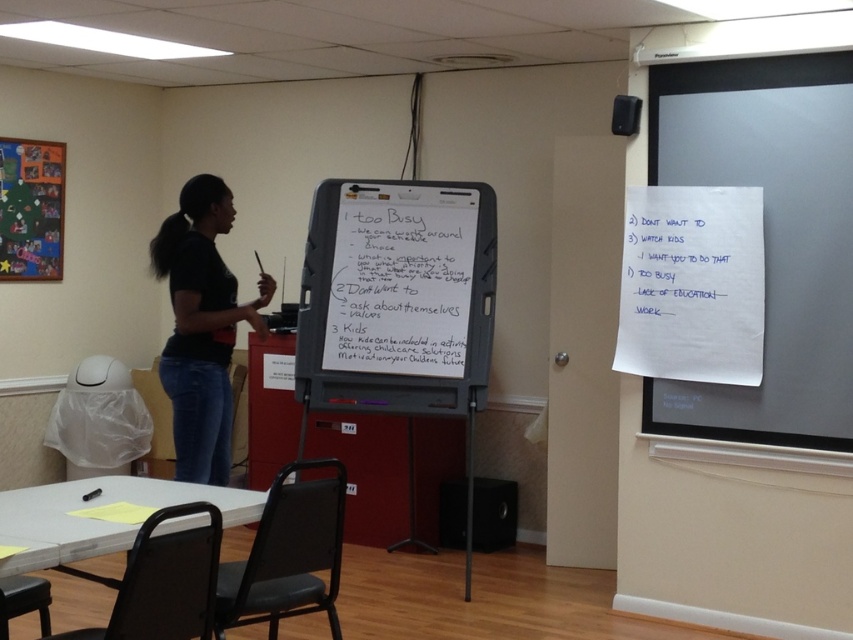
Question: Estimate the real-world distances between objects in this image. Which object is closer to the white paper at upper right?

Choices:
 (A) black matte shirt at center
 (B) white matte dry erase board at center
 (C) whiteboard at center

Answer: (C)

Question: Does whiteboard at center have a smaller size compared to white paper at upper right?

Choices:
 (A) yes
 (B) no

Answer: (B)

Question: Which point is closer to the camera taking this photo?

Choices:
 (A) (712, 292)
 (B) (453, 236)
 (C) (405, 209)

Answer: (A)

Question: Is whiteboard at center further to the viewer compared to white matte dry erase board at center?

Choices:
 (A) no
 (B) yes

Answer: (A)

Question: Which of the following is the closest to the observer?

Choices:
 (A) whiteboard at center
 (B) white paper at upper right
 (C) black matte shirt at center
 (D) white matte dry erase board at center

Answer: (C)

Question: Does whiteboard at center have a lesser width compared to black matte shirt at center?

Choices:
 (A) yes
 (B) no

Answer: (B)